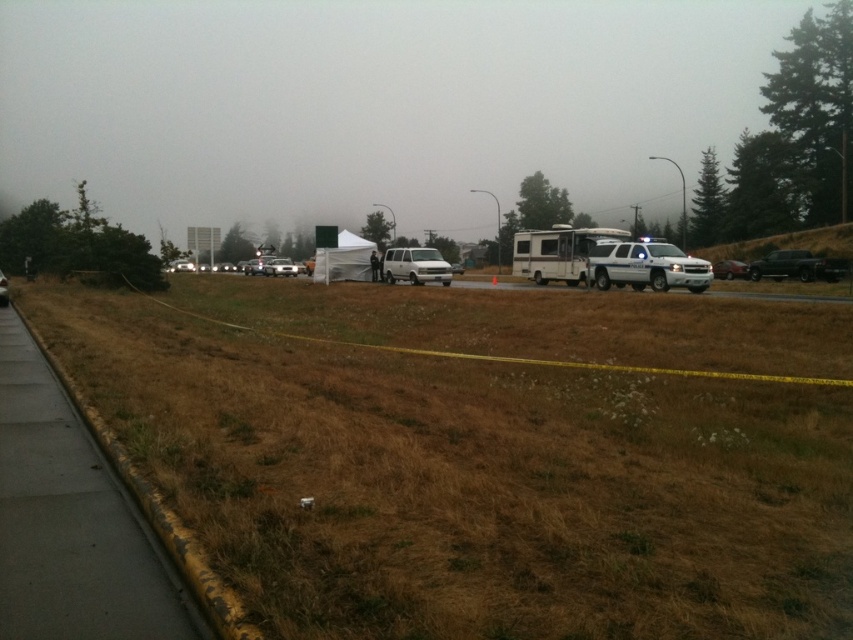
Question: Is brown dry grass at lower left to the right of metallic silver sedan at right from the viewer's perspective?

Choices:
 (A) no
 (B) yes

Answer: (A)

Question: Which point appears farthest from the camera in this image?

Choices:
 (A) (606, 275)
 (B) (390, 273)
 (C) (604, 540)
 (D) (721, 276)

Answer: (D)

Question: Among these objects, which one is nearest to the camera?

Choices:
 (A) white matte van at center
 (B) brown dry grass at lower left

Answer: (B)

Question: Does brown dry grass at lower left appear over white glossy suv at right?

Choices:
 (A) no
 (B) yes

Answer: (A)

Question: Does white glossy suv at right appear on the left side of white matte van at center?

Choices:
 (A) no
 (B) yes

Answer: (A)

Question: Which object is positioned farthest from the brown dry grass at lower left?

Choices:
 (A) white matte van at center
 (B) metallic silver sedan at right

Answer: (B)